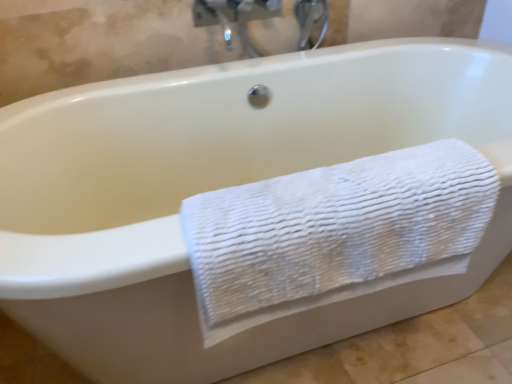
Question: From a real-world perspective, is matte silver faucet at upper center positioned over white textured towel at lower right based on gravity?

Choices:
 (A) no
 (B) yes

Answer: (B)

Question: Is matte silver faucet at upper center facing away from white textured towel at lower right?

Choices:
 (A) no
 (B) yes

Answer: (A)

Question: Is matte silver faucet at upper center completely or partially outside of white textured towel at lower right?

Choices:
 (A) yes
 (B) no

Answer: (A)

Question: Does matte silver faucet at upper center have a larger size compared to white textured towel at lower right?

Choices:
 (A) yes
 (B) no

Answer: (B)

Question: Is the depth of matte silver faucet at upper center greater than that of white textured towel at lower right?

Choices:
 (A) no
 (B) yes

Answer: (B)

Question: Is matte silver faucet at upper center in contact with white textured towel at lower right?

Choices:
 (A) no
 (B) yes

Answer: (A)

Question: Is there a large distance between white textured towel at lower right and matte silver faucet at upper center?

Choices:
 (A) no
 (B) yes

Answer: (A)

Question: Is white textured towel at lower right smaller than matte silver faucet at upper center?

Choices:
 (A) yes
 (B) no

Answer: (B)

Question: Is white textured towel at lower right thinner than matte silver faucet at upper center?

Choices:
 (A) yes
 (B) no

Answer: (B)

Question: Is white textured towel at lower right taller than matte silver faucet at upper center?

Choices:
 (A) no
 (B) yes

Answer: (B)

Question: From the image's perspective, would you say white textured towel at lower right is positioned over matte silver faucet at upper center?

Choices:
 (A) no
 (B) yes

Answer: (A)

Question: Is white textured towel at lower right positioned beyond the bounds of matte silver faucet at upper center?

Choices:
 (A) no
 (B) yes

Answer: (B)

Question: Is matte silver faucet at upper center to the left or to the right of white textured towel at lower right in the image?

Choices:
 (A) right
 (B) left

Answer: (A)